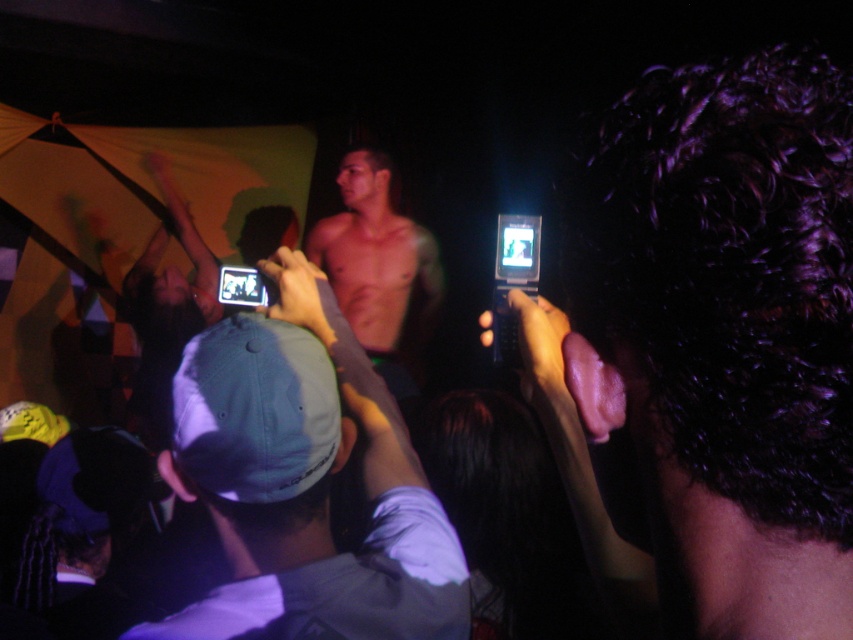
You are at the concert and want to take a photo of the performer without blocking others. The shiny black phone at center is in your way. Where should you move to avoid it?

The shiny black phone at center is located at point [712,348]. To avoid blocking others, move to an area away from this coordinate, such as to the left or right side of the venue.

You are at a concert and want to take a photo of the performer without any obstructions. You notice the shiny black phone at center and the gray fabric cap at center. Which object is blocking your view of the performer?

The shiny black phone at center is positioned over gray fabric cap at center, so the shiny black phone at center is blocking your view of the performer.

You are a photographer at the concert. You want to take a photo that includes both the gray fabric cap at center and the smooth skin torso at center. Which object should you focus on first to ensure both are in the frame?

The gray fabric cap at center is located below the smooth skin torso at center, so you should focus on the smooth skin torso at center first to ensure both are in the frame.